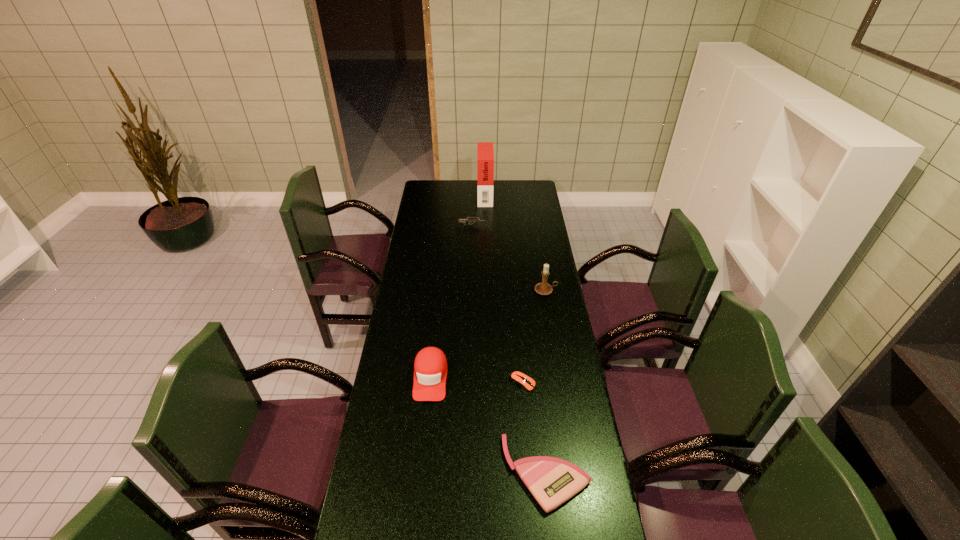
This screenshot has width=960, height=540. Find the location of `free space between the computer mouse and the third farthest object`. free space between the computer mouse and the third farthest object is located at coordinates (535, 336).

This screenshot has width=960, height=540. Identify the location of free space between the baseball cap and the fifth shortest object. (488, 334).

This screenshot has width=960, height=540. I want to click on vacant area that lies between the nearest object and the fourth shortest object, so click(488, 425).

Where is `free space between the baseball cap and the second tallest object`? Image resolution: width=960 pixels, height=540 pixels. free space between the baseball cap and the second tallest object is located at coordinates (488, 334).

Where is `blank region between the wristlet and the gun`? The width and height of the screenshot is (960, 540). blank region between the wristlet and the gun is located at coordinates (509, 349).

What are the coordinates of `empty space that is in between the computer mouse and the baseball cap` in the screenshot? It's located at (476, 380).

Find the location of a particular element. The height and width of the screenshot is (540, 960). object that is the fourth closest to the nearest object is located at coordinates (473, 220).

Choose which object is the fifth nearest neighbor to the farthest object. Please provide its 2D coordinates. Your answer should be formatted as a tuple, i.e. [(x, y)], where the tuple contains the x and y coordinates of a point satisfying the conditions above.

[(552, 481)]

Find the location of a particular element. Image resolution: width=960 pixels, height=540 pixels. blank space that satisfies the following two spatial constraints: 1. on the front-facing side of the cigarette case; 2. on the right side of the second shortest object is located at coordinates click(x=490, y=472).

At what (x,y) coordinates should I click in order to perform the action: click on blank space that satisfies the following two spatial constraints: 1. on the front-facing side of the shortest object; 2. on the left side of the tallest object. Please return your answer as a coordinate pair (x, y). This screenshot has height=540, width=960. Looking at the image, I should click on (489, 383).